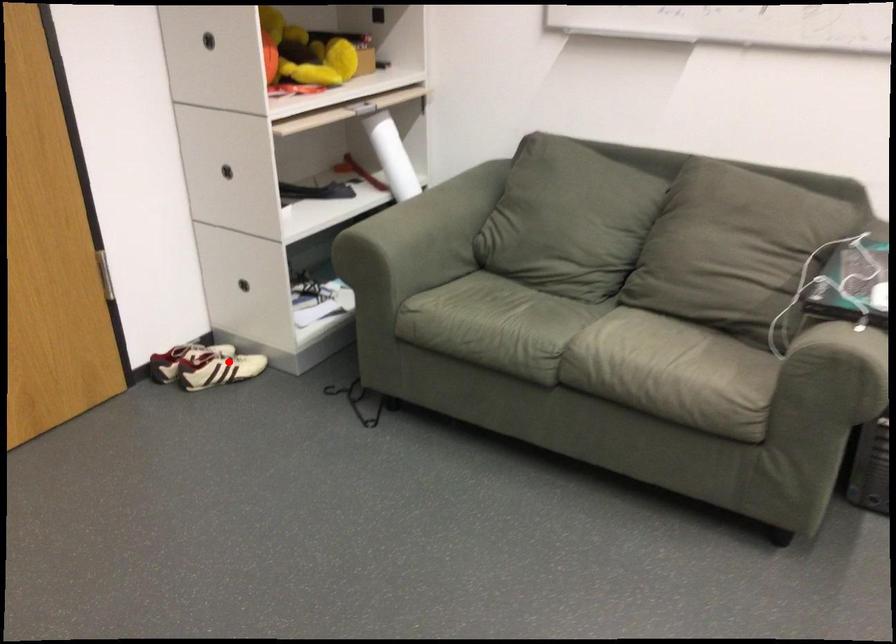
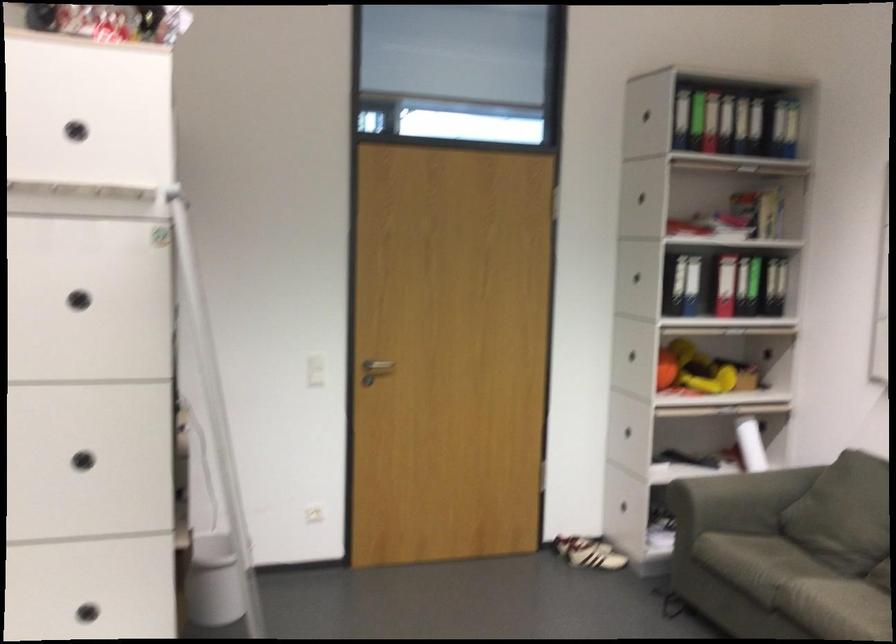
Question: I am providing you with two images of the same scene from different viewpoints. Given a red point in image1, look at the same physical point in image2. Is it:

Choices:
 (A) Closer to the viewpoint
 (B) Farther from the viewpoint

Answer: (B)